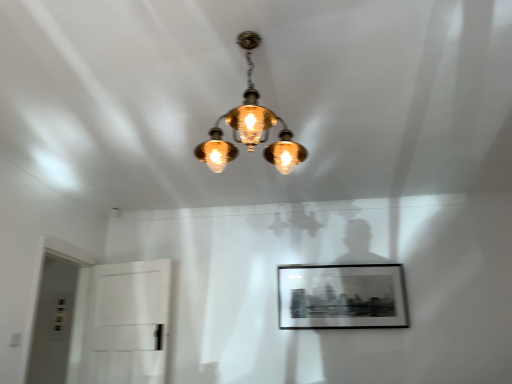
Question: Can you confirm if matte brass chandelier at center is shorter than transparent glass door at lower left, placed as the 2th glass door when sorted from right to left?

Choices:
 (A) yes
 (B) no

Answer: (A)

Question: Is matte brass chandelier at center smaller than transparent glass door at lower left, placed as the 2th glass door when sorted from right to left?

Choices:
 (A) yes
 (B) no

Answer: (A)

Question: Is matte brass chandelier at center in contact with transparent glass door at lower left, placed as the 2th glass door when sorted from right to left?

Choices:
 (A) yes
 (B) no

Answer: (B)

Question: Is the position of matte brass chandelier at center less distant than that of transparent glass door at lower left, which is the 1th glass door from left to right?

Choices:
 (A) no
 (B) yes

Answer: (B)

Question: Is transparent glass door at lower left, placed as the 2th glass door when sorted from right to left, at the back of matte brass chandelier at center?

Choices:
 (A) yes
 (B) no

Answer: (B)

Question: Which is correct: matte brass chandelier at center is inside white glossy door at left, which ranks as the first glass door in right-to-left order, or outside of it?

Choices:
 (A) inside
 (B) outside

Answer: (B)

Question: Considering the positions of matte brass chandelier at center and white glossy door at left, which ranks as the first glass door in right-to-left order, in the image, is matte brass chandelier at center bigger or smaller than white glossy door at left, which ranks as the first glass door in right-to-left order,?

Choices:
 (A) small
 (B) big

Answer: (B)

Question: In terms of height, does matte brass chandelier at center look taller or shorter compared to white glossy door at left, which appears as the second glass door when viewed from the left?

Choices:
 (A) tall
 (B) short

Answer: (B)

Question: Looking at their shapes, would you say matte brass chandelier at center is wider or thinner than white glossy door at left, which ranks as the first glass door in right-to-left order?

Choices:
 (A) thin
 (B) wide

Answer: (B)

Question: Is transparent glass door at lower left, placed as the 2th glass door when sorted from right to left, to the left or to the right of white glossy door at left, which appears as the second glass door when viewed from the left, in the image?

Choices:
 (A) right
 (B) left

Answer: (B)

Question: Is transparent glass door at lower left, which is the 1th glass door from left to right, in front of or behind white glossy door at left, which ranks as the first glass door in right-to-left order, in the image?

Choices:
 (A) front
 (B) behind

Answer: (A)

Question: Considering the positions of transparent glass door at lower left, placed as the 2th glass door when sorted from right to left, and white glossy door at left, which ranks as the first glass door in right-to-left order, in the image, is transparent glass door at lower left, placed as the 2th glass door when sorted from right to left, taller or shorter than white glossy door at left, which ranks as the first glass door in right-to-left order,?

Choices:
 (A) tall
 (B) short

Answer: (A)

Question: From a real-world perspective, is transparent glass door at lower left, which is the 1th glass door from left to right, above or below white glossy door at left, which ranks as the first glass door in right-to-left order?

Choices:
 (A) above
 (B) below

Answer: (A)

Question: From the image's perspective, is white glossy door at left, which ranks as the first glass door in right-to-left order, positioned above or below transparent glass door at lower left, which is the 1th glass door from left to right?

Choices:
 (A) below
 (B) above

Answer: (A)

Question: In terms of height, does white glossy door at left, which appears as the second glass door when viewed from the left, look taller or shorter compared to transparent glass door at lower left, placed as the 2th glass door when sorted from right to left?

Choices:
 (A) short
 (B) tall

Answer: (A)